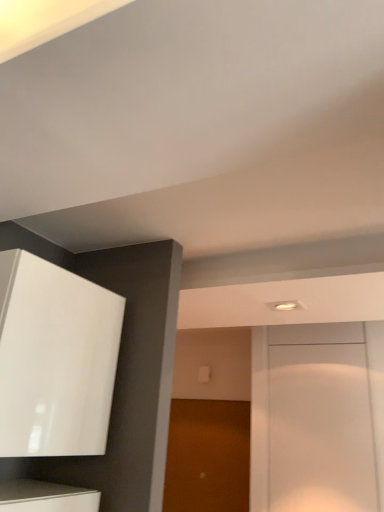
Where is `vacant point above brown matte door at center, the second door positioned from the right (from a real-world perspective)`? vacant point above brown matte door at center, the second door positioned from the right (from a real-world perspective) is located at coordinates (207, 401).